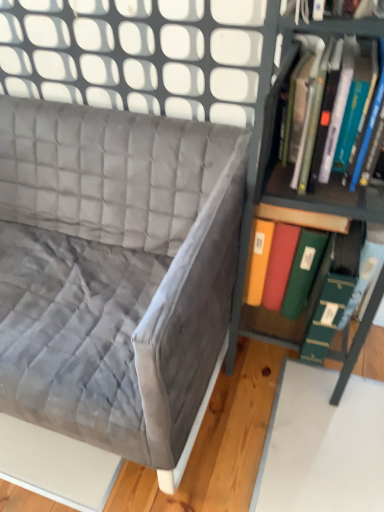
Question: Is green matte folder at right, the second book viewed from the top, facing away from hardcover book at right, which ranks as the first book in top-to-bottom order?

Choices:
 (A) no
 (B) yes

Answer: (A)

Question: Considering the relative sizes of green matte folder at right, the second book viewed from the top, and hardcover book at right, which ranks as the first book in top-to-bottom order, in the image provided, is green matte folder at right, the second book viewed from the top, smaller than hardcover book at right, which ranks as the first book in top-to-bottom order,?

Choices:
 (A) yes
 (B) no

Answer: (B)

Question: Does green matte folder at right, acting as the first book starting from the bottom, have a lesser height compared to hardcover book at right, which ranks as the first book in top-to-bottom order?

Choices:
 (A) no
 (B) yes

Answer: (A)

Question: Are green matte folder at right, acting as the first book starting from the bottom, and hardcover book at right, the second book in the bottom-to-top sequence, beside each other?

Choices:
 (A) no
 (B) yes

Answer: (A)

Question: Are green matte folder at right, the second book viewed from the top, and hardcover book at right, which ranks as the first book in top-to-bottom order, located far from each other?

Choices:
 (A) yes
 (B) no

Answer: (B)

Question: From the image's perspective, relative to green matte folder at right, acting as the first book starting from the bottom, is velvet gray couch at upper left above or below?

Choices:
 (A) below
 (B) above

Answer: (A)

Question: Does point (155, 190) appear closer or farther from the camera than point (339, 245)?

Choices:
 (A) closer
 (B) farther

Answer: (B)

Question: Is velvet gray couch at upper left inside the boundaries of green matte folder at right, acting as the first book starting from the bottom, or outside?

Choices:
 (A) inside
 (B) outside

Answer: (B)

Question: Is velvet gray couch at upper left to the left or to the right of green matte folder at right, acting as the first book starting from the bottom, in the image?

Choices:
 (A) right
 (B) left

Answer: (B)

Question: In terms of height, does metallic green bookshelf at right look taller or shorter compared to green matte folder at right, the second book viewed from the top?

Choices:
 (A) tall
 (B) short

Answer: (A)

Question: Considering the positions of metallic green bookshelf at right and green matte folder at right, the second book viewed from the top, in the image, is metallic green bookshelf at right bigger or smaller than green matte folder at right, the second book viewed from the top,?

Choices:
 (A) small
 (B) big

Answer: (B)

Question: Looking at their shapes, would you say metallic green bookshelf at right is wider or thinner than green matte folder at right, the second book viewed from the top?

Choices:
 (A) thin
 (B) wide

Answer: (A)

Question: Visually, is metallic green bookshelf at right positioned to the left or to the right of green matte folder at right, the second book viewed from the top?

Choices:
 (A) left
 (B) right

Answer: (A)

Question: From a real-world perspective, is hardcover book at right, the second book in the bottom-to-top sequence, physically located above or below metallic green bookshelf at right?

Choices:
 (A) above
 (B) below

Answer: (A)

Question: Is hardcover book at right, which ranks as the first book in top-to-bottom order, taller or shorter than metallic green bookshelf at right?

Choices:
 (A) tall
 (B) short

Answer: (B)